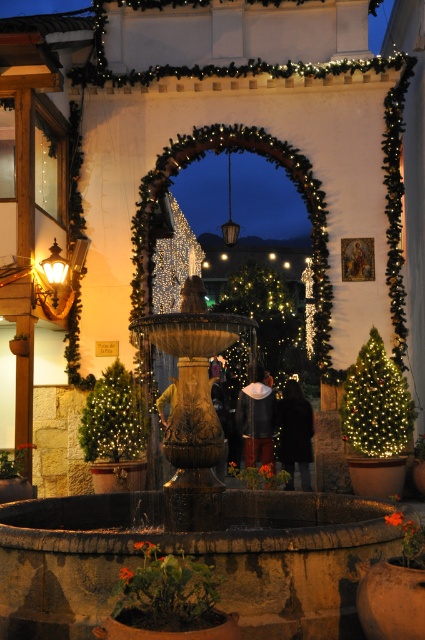
Question: Does green matte christmas tree at lower left have a lesser width compared to golden hair at center?

Choices:
 (A) yes
 (B) no

Answer: (B)

Question: Which object appears farthest from the camera in this image?

Choices:
 (A) black fabric at center
 (B) stone fountain at center

Answer: (A)

Question: Does black fabric at center come in front of dark gray knit hat at center?

Choices:
 (A) yes
 (B) no

Answer: (A)

Question: Which of the following is the farthest from the observer?

Choices:
 (A) golden hair at center
 (B) green matte christmas tree at right

Answer: (A)

Question: Can you confirm if green matte christmas tree at right is positioned below dark gray knit hat at center?

Choices:
 (A) no
 (B) yes

Answer: (A)

Question: Which object appears closest to the camera in this image?

Choices:
 (A) golden hair at center
 (B) green matte christmas tree at right
 (C) stone fountain at center

Answer: (C)